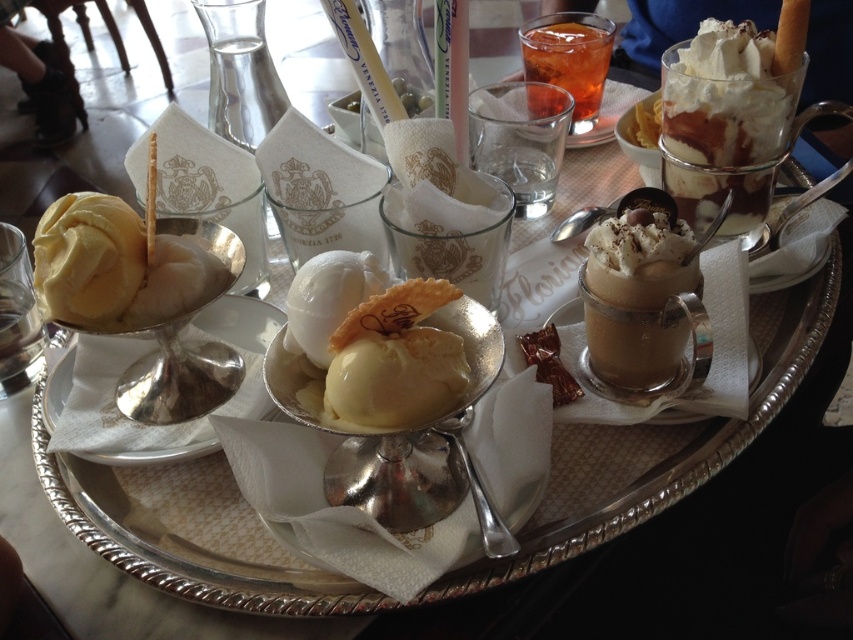
Question: Which point is closer to the camera?

Choices:
 (A) (386, 317)
 (B) (729, 132)

Answer: (A)

Question: Observing the image, what is the correct spatial positioning of yellow creamy ice cream at left in reference to translucent glass drink at upper center?

Choices:
 (A) right
 (B) left

Answer: (B)

Question: Is swirled caramel ice cream sundae at upper right above yellow creamy ice cream at center?

Choices:
 (A) yes
 (B) no

Answer: (A)

Question: Considering the real-world distances, which object is farthest from the swirled caramel ice cream sundae at upper right?

Choices:
 (A) yellow creamy ice cream at center
 (B) yellow creamy ice cream at left
 (C) smooth chocolate mousse at center
 (D) translucent glass drink at upper center

Answer: (B)

Question: Which point appears farthest from the camera in this image?

Choices:
 (A) (697, 70)
 (B) (596, 32)

Answer: (B)

Question: Can you confirm if yellow creamy ice cream at center is positioned above yellow creamy ice cream at left?

Choices:
 (A) yes
 (B) no

Answer: (B)